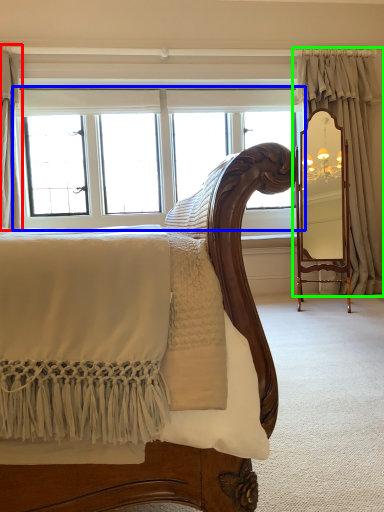
Question: Which object is positioned farthest from curtain (highlighted by a red box)? Select from window (highlighted by a blue box) and curtain (highlighted by a green box).

Choices:
 (A) window
 (B) curtain

Answer: (B)